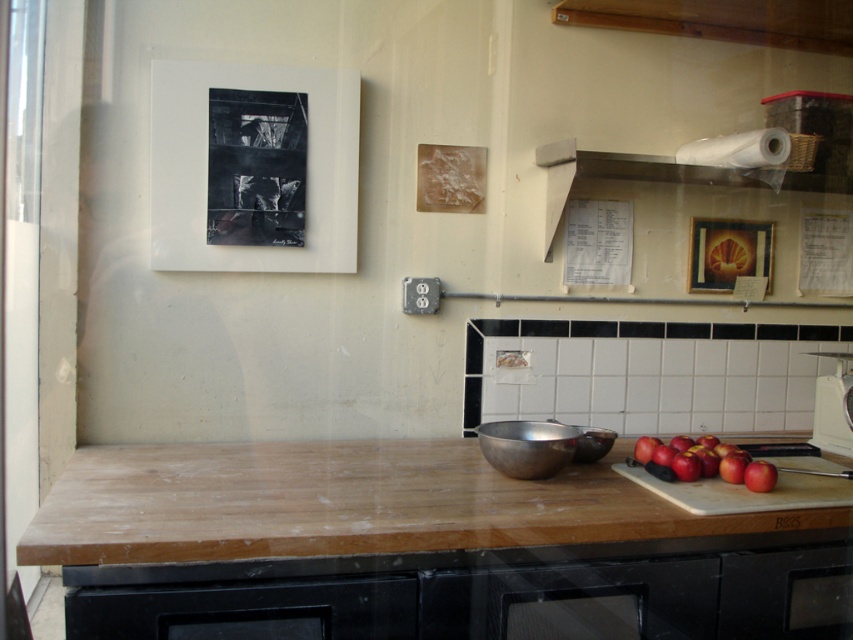
Question: Considering the relative positions of red matte apples at lower right and white glossy scale at right in the image provided, where is red matte apples at lower right located with respect to white glossy scale at right?

Choices:
 (A) above
 (B) below

Answer: (B)

Question: Is white paper at upper center further to camera compared to red matte apple at lower right?

Choices:
 (A) no
 (B) yes

Answer: (B)

Question: Can you confirm if white paper at upper center is thinner than white glossy scale at right?

Choices:
 (A) yes
 (B) no

Answer: (B)

Question: Estimate the real-world distances between objects in this image. Which object is farther from the white paper at upper center?

Choices:
 (A) white matte paper towel at upper right
 (B) red matte apples at lower right
 (C) white glossy scale at right

Answer: (B)

Question: Which is farther from the white glossy scale at right?

Choices:
 (A) wooden cutting board at center
 (B) red matte apples at lower right
 (C) white matte paper towel at upper right

Answer: (A)

Question: Among these points, which one is nearest to the camera?

Choices:
 (A) (757, 132)
 (B) (665, 166)

Answer: (A)